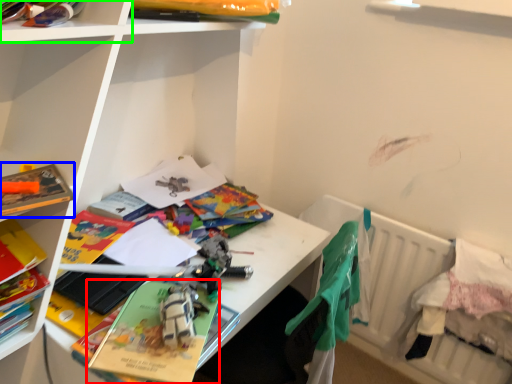
Question: Which object is positioned farthest from paperback book (highlighted by a red box)? Select from paperback book (highlighted by a blue box) and shelf (highlighted by a green box).

Choices:
 (A) paperback book
 (B) shelf

Answer: (B)